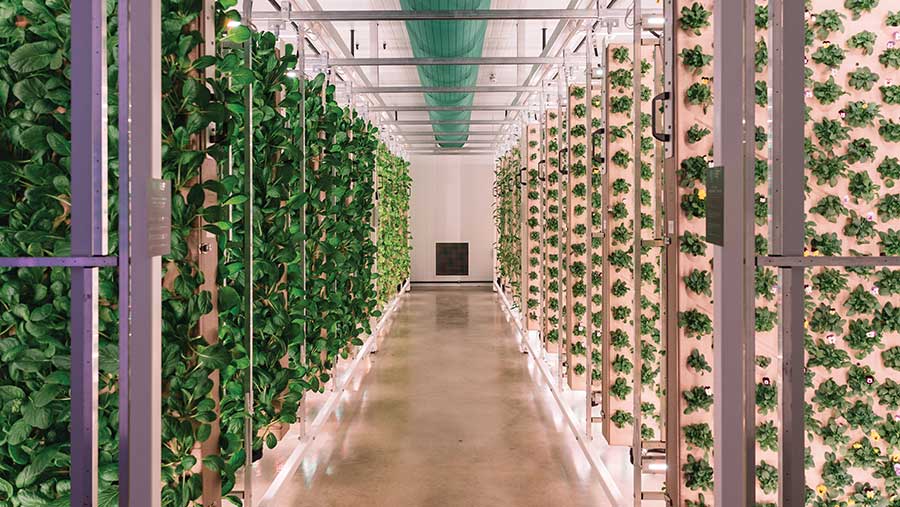
What are the coordinates of `wall` in the screenshot? It's located at (432, 217).